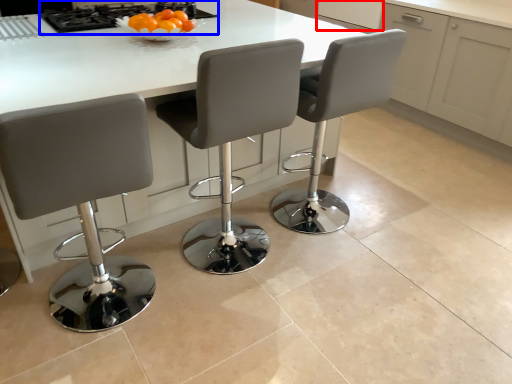
Question: Among these objects, which one is nearest to the camera, cabinetry (highlighted by a red box) or gas stove (highlighted by a blue box)?

Choices:
 (A) cabinetry
 (B) gas stove

Answer: (B)